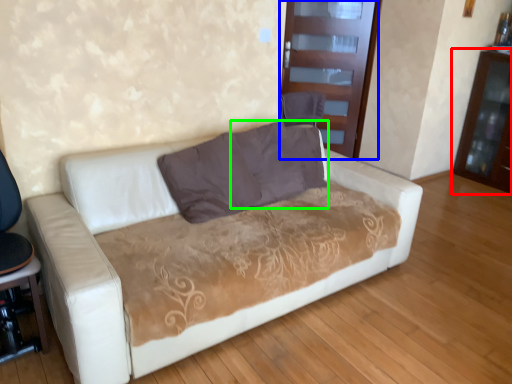
Question: Which is nearer to the dresser (highlighted by a red box)? glass door (highlighted by a blue box) or pillow (highlighted by a green box).

Choices:
 (A) glass door
 (B) pillow

Answer: (A)